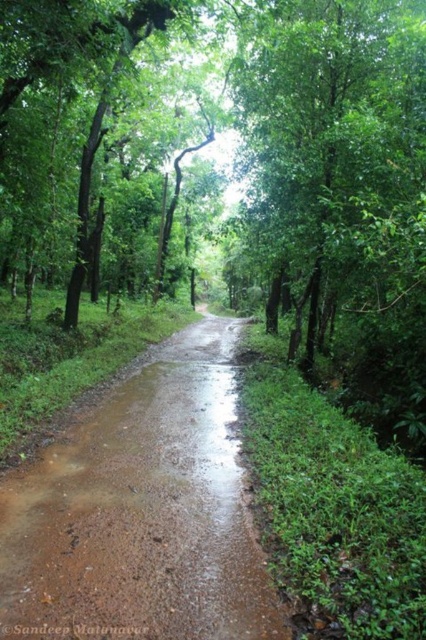
Question: Which object appears farthest from the camera in this image?

Choices:
 (A) green leafy tree at center
 (B) brown muddy dirt track at center

Answer: (A)

Question: Is brown muddy dirt track at center to the left of green leafy tree at center from the viewer's perspective?

Choices:
 (A) yes
 (B) no

Answer: (A)

Question: Can you confirm if brown muddy dirt track at center is positioned to the left of green leafy tree at center?

Choices:
 (A) yes
 (B) no

Answer: (A)

Question: Can you confirm if brown muddy dirt track at center is positioned above green leafy tree at center?

Choices:
 (A) no
 (B) yes

Answer: (A)